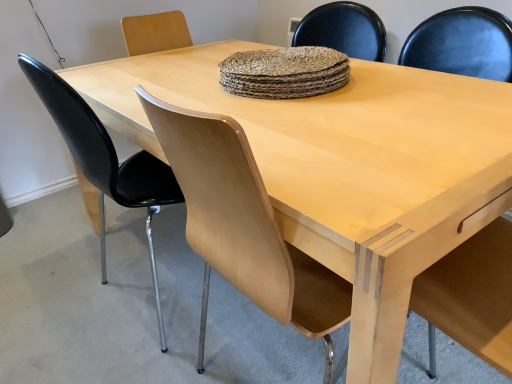
Question: From a real-world perspective, is light wood chair at center, the second chair in the left-to-right sequence, beneath black glossy chair at left, the 2th chair when ordered from right to left?

Choices:
 (A) yes
 (B) no

Answer: (A)

Question: From a real-world perspective, is light wood chair at center, the 1th chair when ordered from right to left, on black glossy chair at left, the 2th chair when ordered from right to left?

Choices:
 (A) no
 (B) yes

Answer: (A)

Question: Considering the relative positions of light wood chair at center, the second chair in the left-to-right sequence, and black glossy chair at left, the 2th chair when ordered from right to left, in the image provided, is light wood chair at center, the second chair in the left-to-right sequence, behind black glossy chair at left, the 2th chair when ordered from right to left,?

Choices:
 (A) no
 (B) yes

Answer: (A)

Question: Is light wood chair at center, the second chair in the left-to-right sequence, turned away from black glossy chair at left, the 1th chair when ordered from left to right?

Choices:
 (A) no
 (B) yes

Answer: (A)

Question: Does light wood chair at center, the 1th chair when ordered from right to left, have a lesser width compared to black glossy chair at left, the 2th chair when ordered from right to left?

Choices:
 (A) no
 (B) yes

Answer: (A)

Question: From the image's perspective, is light wood chair at center, the second chair in the left-to-right sequence, located beneath black glossy chair at left, the 2th chair when ordered from right to left?

Choices:
 (A) no
 (B) yes

Answer: (B)

Question: From the image's perspective, would you say light wood armchair at right is shown under light wood chair at center, the second chair in the left-to-right sequence?

Choices:
 (A) yes
 (B) no

Answer: (A)

Question: Does light wood armchair at right have a larger size compared to light wood chair at center, the 1th chair when ordered from right to left?

Choices:
 (A) yes
 (B) no

Answer: (B)

Question: Is light wood armchair at right thinner than light wood chair at center, the 1th chair when ordered from right to left?

Choices:
 (A) yes
 (B) no

Answer: (A)

Question: Considering the relative sizes of light wood armchair at right and light wood chair at center, the 1th chair when ordered from right to left, in the image provided, is light wood armchair at right taller than light wood chair at center, the 1th chair when ordered from right to left,?

Choices:
 (A) no
 (B) yes

Answer: (A)

Question: From a real-world perspective, is light wood armchair at right below light wood chair at center, the 1th chair when ordered from right to left?

Choices:
 (A) yes
 (B) no

Answer: (A)

Question: Is light wood armchair at right placed right next to light wood chair at center, the 1th chair when ordered from right to left?

Choices:
 (A) no
 (B) yes

Answer: (A)

Question: Does black glossy chair at left, the 1th chair when ordered from left to right, turn towards light wood armchair at right?

Choices:
 (A) yes
 (B) no

Answer: (B)